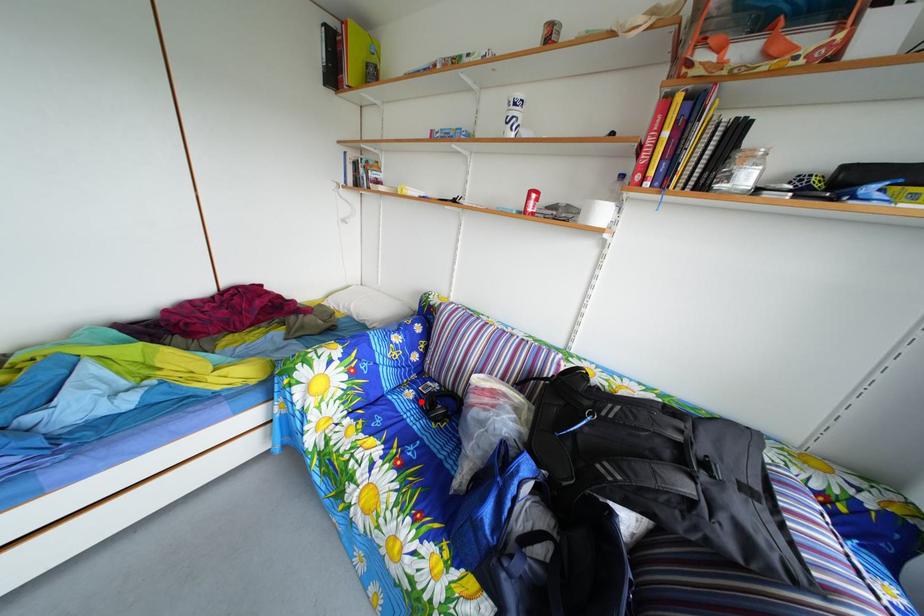
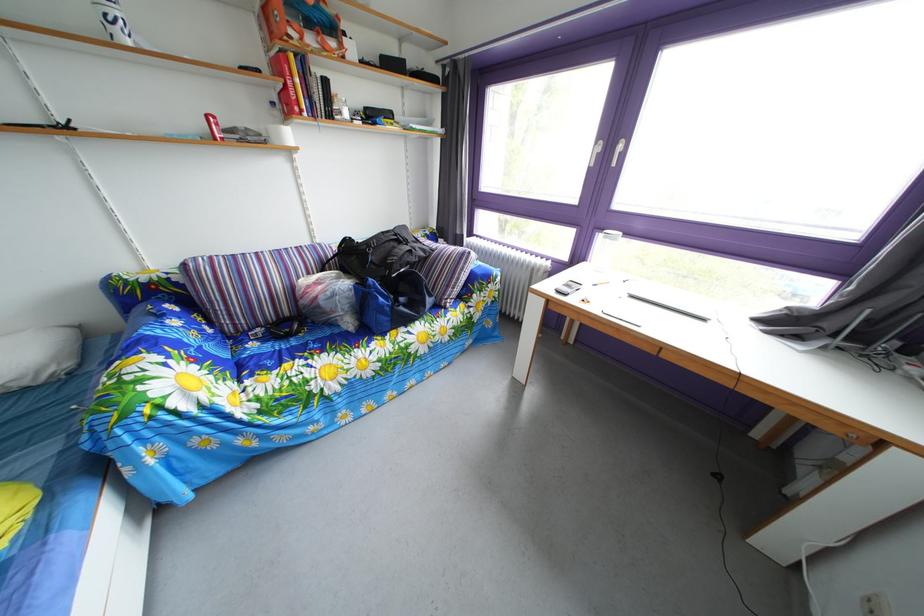
Question: I am providing you with two images of the same scene from different viewpoints. A red point is marked on the first image. Is the red point's position out of view in image 2?

Choices:
 (A) Yes
 (B) No

Answer: (B)